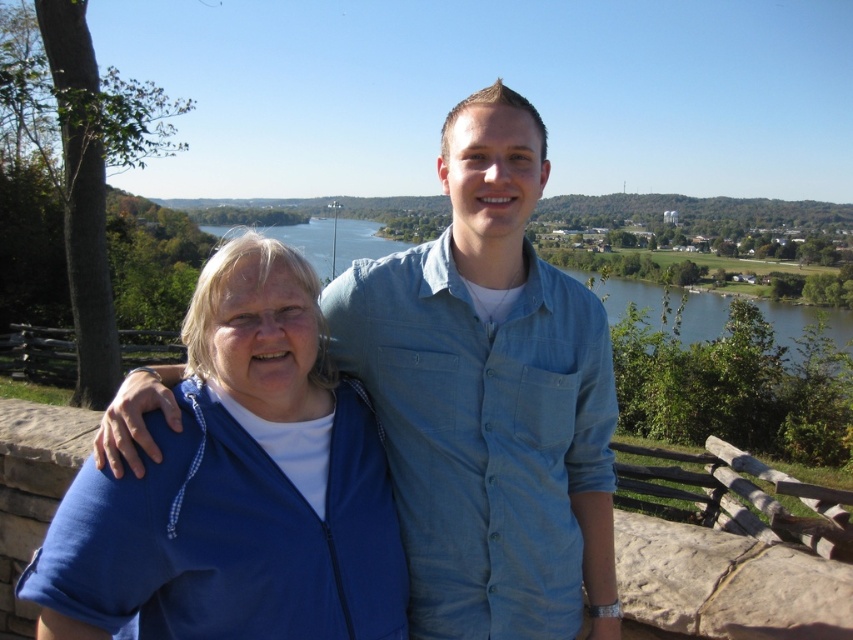
Question: Does blue denim shirt at center appear on the left side of blue fleece jacket at left?

Choices:
 (A) no
 (B) yes

Answer: (A)

Question: Can you confirm if blue denim shirt at center is smaller than blue fleece jacket at left?

Choices:
 (A) yes
 (B) no

Answer: (B)

Question: Which object appears farthest from the camera in this image?

Choices:
 (A) blue fleece jacket at left
 (B) blue denim shirt at center

Answer: (B)

Question: Is blue denim shirt at center thinner than blue fleece jacket at left?

Choices:
 (A) no
 (B) yes

Answer: (B)

Question: Which object appears closest to the camera in this image?

Choices:
 (A) blue denim shirt at center
 (B) blue fleece jacket at left

Answer: (B)